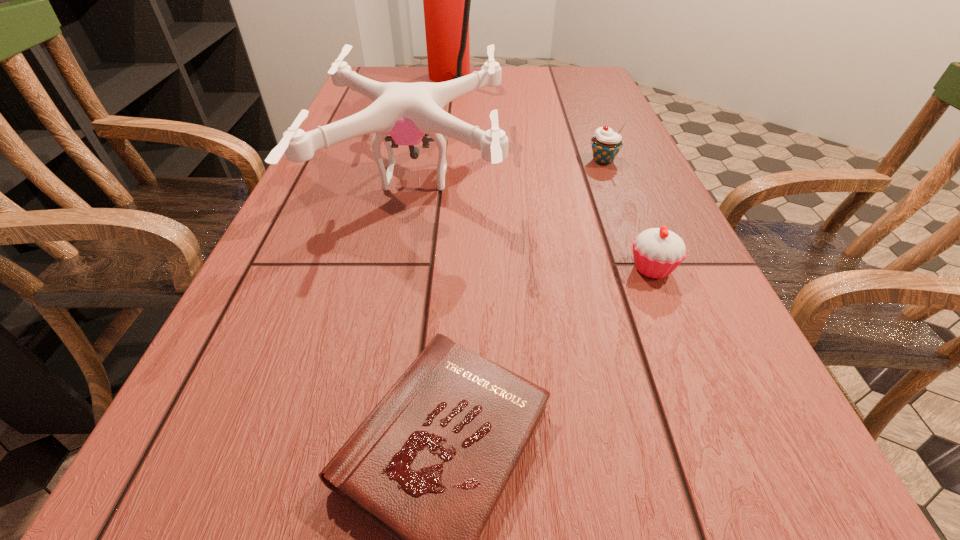
Where is `fire extinguisher`? This screenshot has width=960, height=540. fire extinguisher is located at coordinates (446, 0).

The image size is (960, 540). Find the location of `the tallest object`. the tallest object is located at coordinates (446, 0).

Locate an element on the screen. This screenshot has height=540, width=960. the fourth shortest object is located at coordinates click(x=406, y=111).

Locate an element on the screen. the farther cupcake is located at coordinates (606, 144).

Where is `the third tallest object`? Image resolution: width=960 pixels, height=540 pixels. the third tallest object is located at coordinates (606, 144).

Find the location of a particular element. This screenshot has width=960, height=540. the second shortest object is located at coordinates (657, 252).

Image resolution: width=960 pixels, height=540 pixels. What are the coordinates of `the nearer cupcake` in the screenshot? It's located at (657, 252).

This screenshot has width=960, height=540. I want to click on vacant region located 0.150m on the top of the drone, so click(570, 177).

Locate an element on the screen. free point located on the left of the farther cupcake is located at coordinates (500, 160).

I want to click on vacant region located on the front of the fourth tallest object, so click(764, 538).